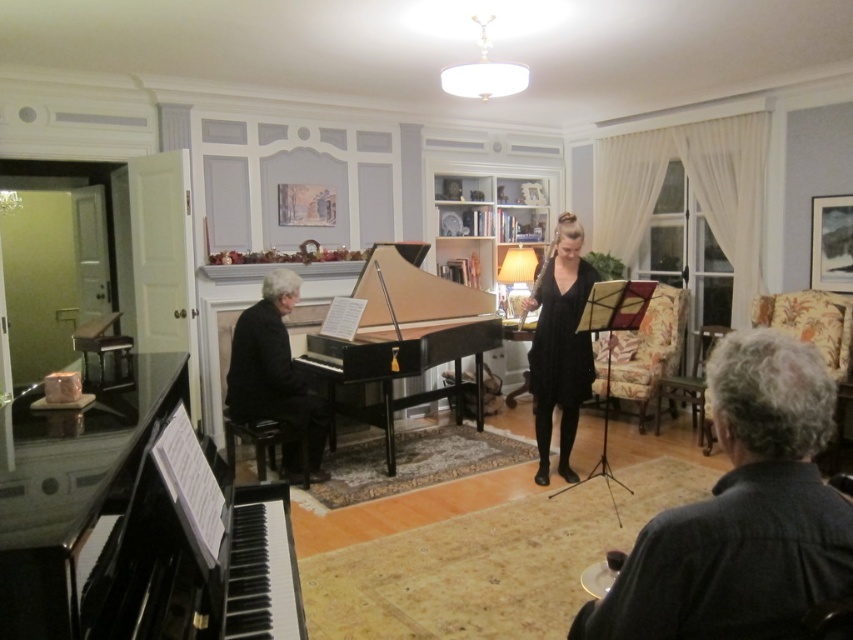
Can you confirm if black polished piano at left is positioned above black polished wood grand piano at center?

No.

Does point (160, 531) lie behind point (408, 248)?

No.

Find the location of a particular element. Image resolution: width=853 pixels, height=640 pixels. black polished piano at left is located at coordinates (135, 524).

Can you confirm if dark gray fabric jacket at lower right is wider than black polished wood grand piano at center?

Incorrect, dark gray fabric jacket at lower right's width does not surpass black polished wood grand piano at center's.

Is dark gray fabric jacket at lower right positioned before black polished wood grand piano at center?

Yes, dark gray fabric jacket at lower right is in front of black polished wood grand piano at center.

Locate an element on the screen. dark gray fabric jacket at lower right is located at coordinates (741, 513).

Find the location of a particular element. Image resolution: width=853 pixels, height=640 pixels. dark gray fabric jacket at lower right is located at coordinates (741, 513).

Measure the distance from black polished wood grand piano at center to black satin dress at center.

A distance of 1.01 meters exists between black polished wood grand piano at center and black satin dress at center.

This screenshot has width=853, height=640. In order to click on black polished wood grand piano at center in this screenshot , I will do `click(404, 339)`.